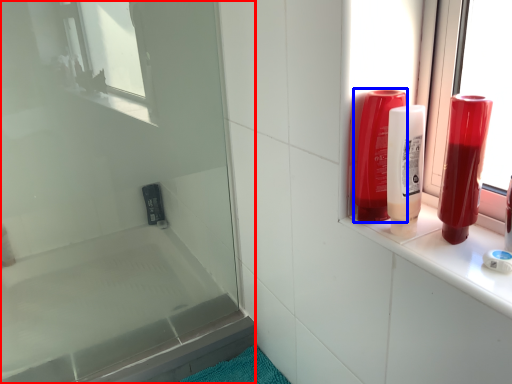
Question: Which of the following is the farthest to the observer, screen door (highlighted by a red box) or mouthwash (highlighted by a blue box)?

Choices:
 (A) screen door
 (B) mouthwash

Answer: (A)